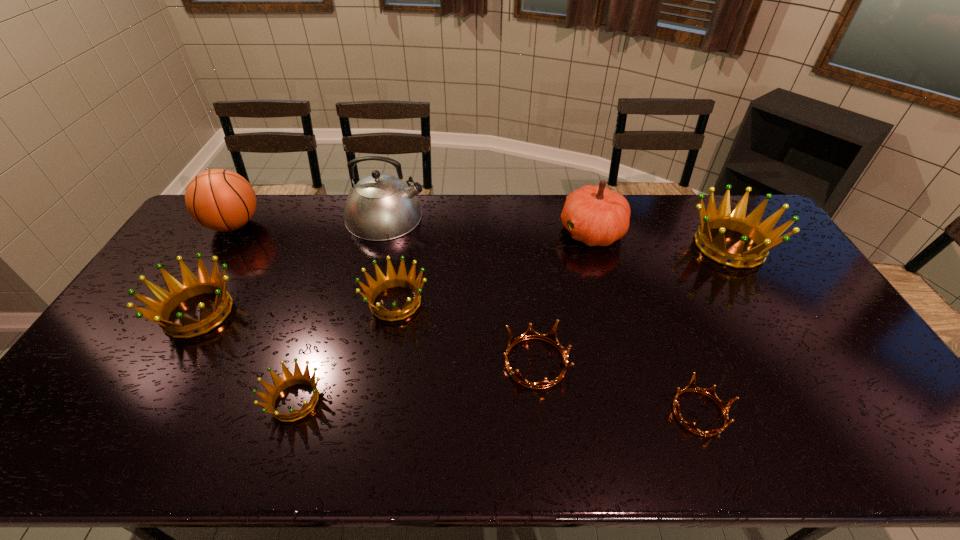
You are a GUI agent. You are given a task and a screenshot of the screen. Output one action in this format:
    pyautogui.click(x=<x>, y=<y>)
    Task: Click on the free point located on the left of the rightmost crown
    This screenshot has height=540, width=960.
    Given the screenshot: What is the action you would take?
    pyautogui.click(x=568, y=246)

Find the location of `vacant space situated 0.070m on the front of the second biggest golden crown`. vacant space situated 0.070m on the front of the second biggest golden crown is located at coordinates (164, 370).

What are the coordinates of `vacant space located on the back of the third tallest crown` in the screenshot? It's located at (407, 236).

The width and height of the screenshot is (960, 540). Identify the location of blank space located 0.380m on the back of the third crown from right to left. (523, 246).

At what (x,y) coordinates should I click in order to perform the action: click on free space located on the back of the second crown from left to right. Please return your answer as a coordinate pair (x, y). Looking at the image, I should click on (316, 337).

Identify the location of vacant space located on the left of the smaller gold crown. (573, 413).

Where is `kettle situated at the far edge`? Image resolution: width=960 pixels, height=540 pixels. kettle situated at the far edge is located at coordinates (380, 207).

Where is `basketball that is at the far edge`? basketball that is at the far edge is located at coordinates (221, 200).

Find the location of `pumpkin that is at the far edge`. pumpkin that is at the far edge is located at coordinates (595, 215).

I want to click on crown that is at the far edge, so 760,233.